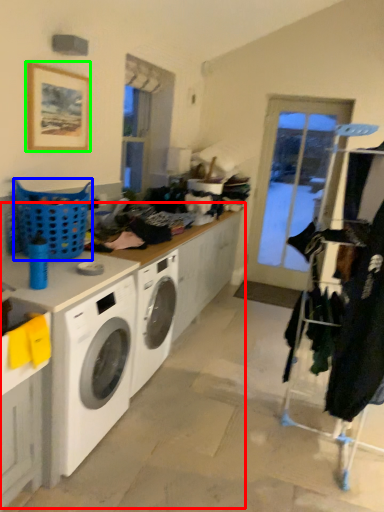
Question: Which object is the closest to the counter top (highlighted by a red box)? Choose among these: basket (highlighted by a blue box) or picture frame (highlighted by a green box).

Choices:
 (A) basket
 (B) picture frame

Answer: (A)